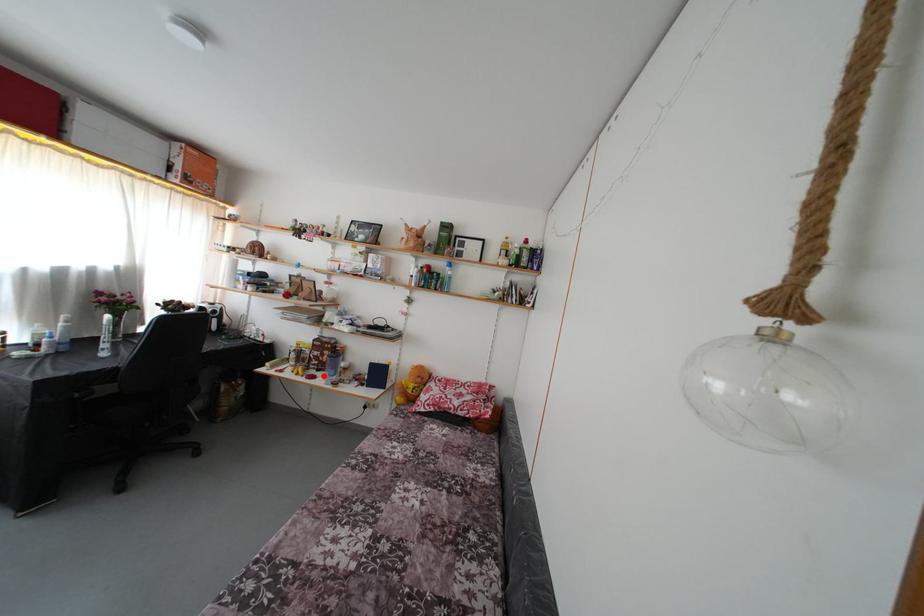
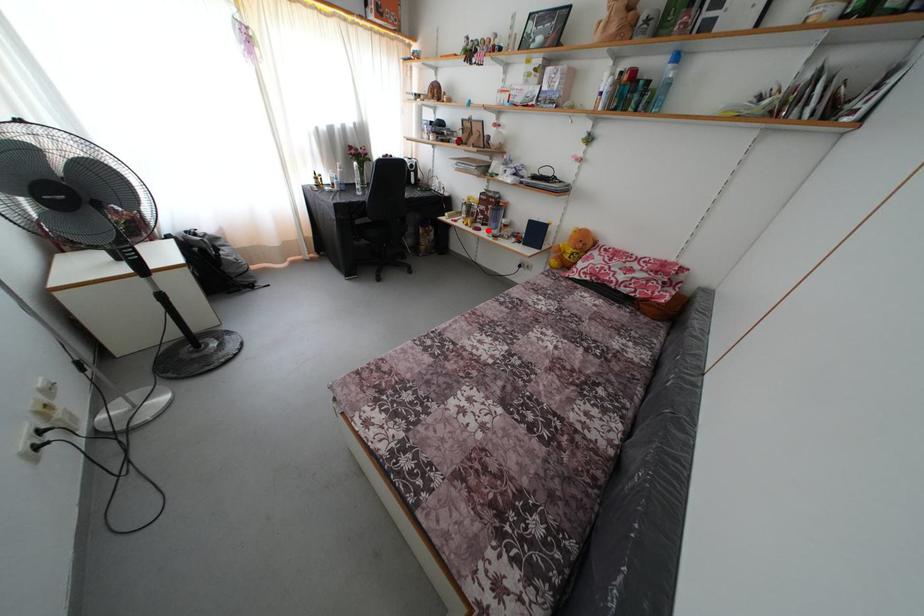
I am providing you with two images of the same scene from different viewpoints. A red point is marked on the first image and another point is marked on the second image. Do the highlighted points in image1 and image2 indicate the same real-world spot?

Yes